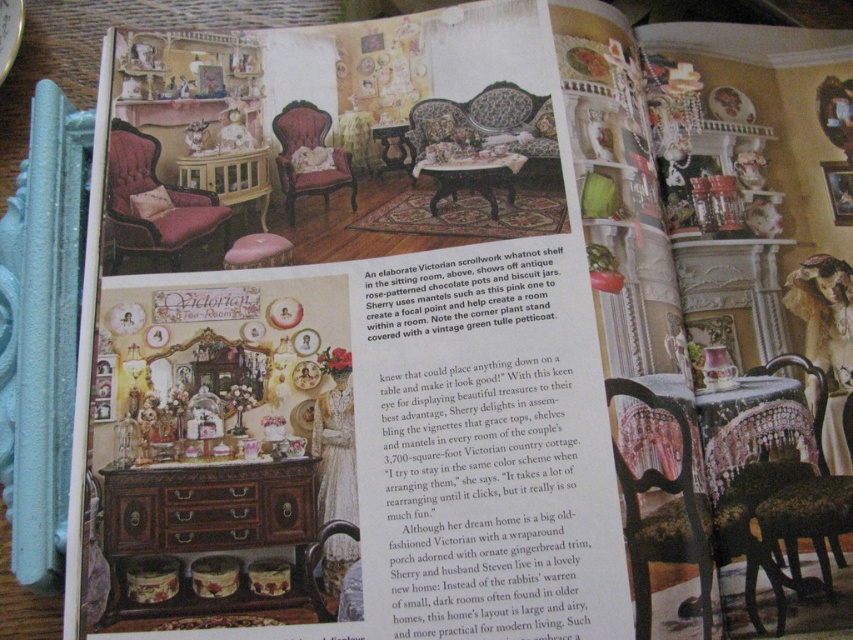
You are a decorator planning to place a 10 inch wide decorative vase between the black lace table at center and the velvet pink armchair at center. Can the vase fit in the space between them without overlapping?

The black lace table at center is 9.70 inches away from the velvet pink armchair at center. Since the vase is 10 inches wide, it would not fit as the space between them is slightly narrower than the vase.